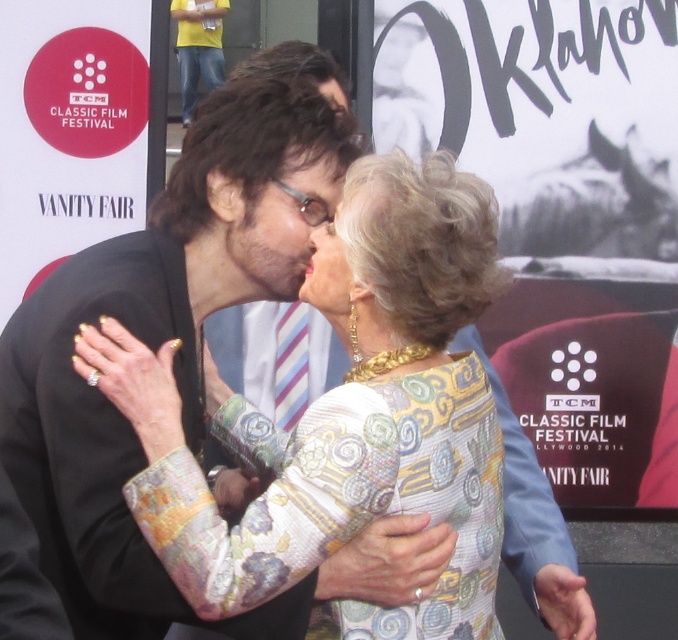
You are a photographer at the TCM Classic Film Festival. You need to capture a closeup shot of both the matte black face at center and the matte gold necklace at center. What is the minimum distance your camera lens should be set to in order to clearly capture both subjects in focus?

The minimum distance your camera lens should be set to is 8.23 inches because the matte black face at center and the matte gold necklace at center are 8.23 inches apart from each other, ensuring both are in focus.